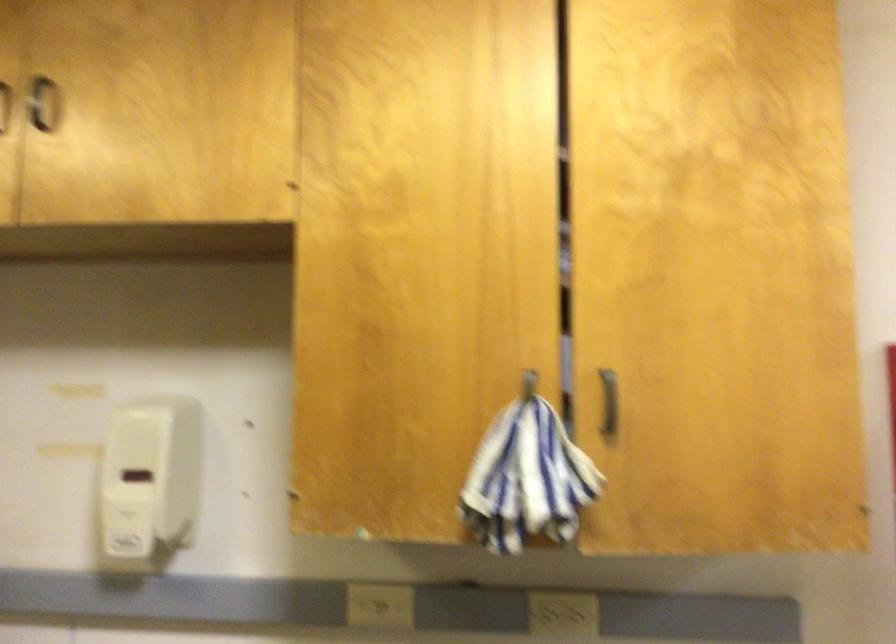
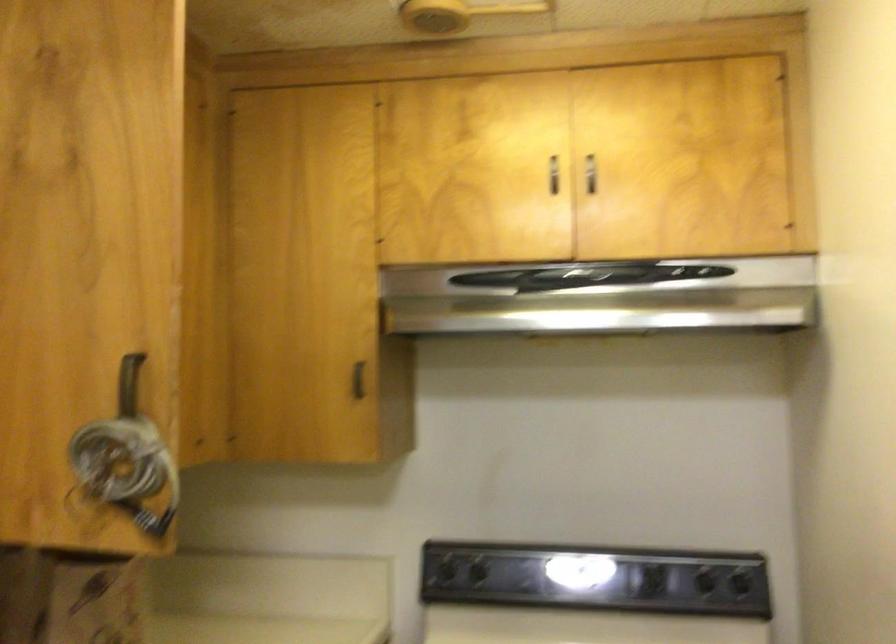
Question: The camera is either moving clockwise (left) or counter-clockwise (right) around the object. The first image is from the beginning of the video and the second image is from the end. Is the camera moving left or right when shooting the video?

Choices:
 (A) Left
 (B) Right

Answer: (B)